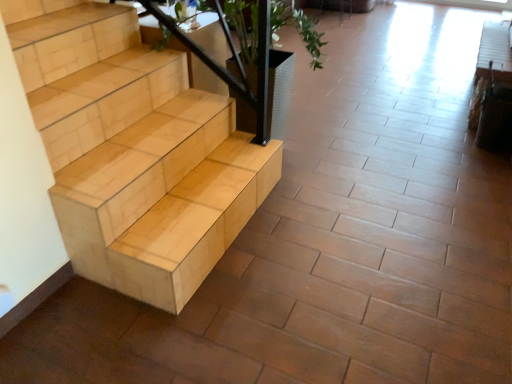
Where is `black textured vase at center`? This screenshot has height=384, width=512. black textured vase at center is located at coordinates (279, 91).

Describe the element at coordinates (279, 91) in the screenshot. The image size is (512, 384). I see `black textured vase at center` at that location.

The height and width of the screenshot is (384, 512). What are the coordinates of `black textured vase at center` in the screenshot? It's located at (279, 91).